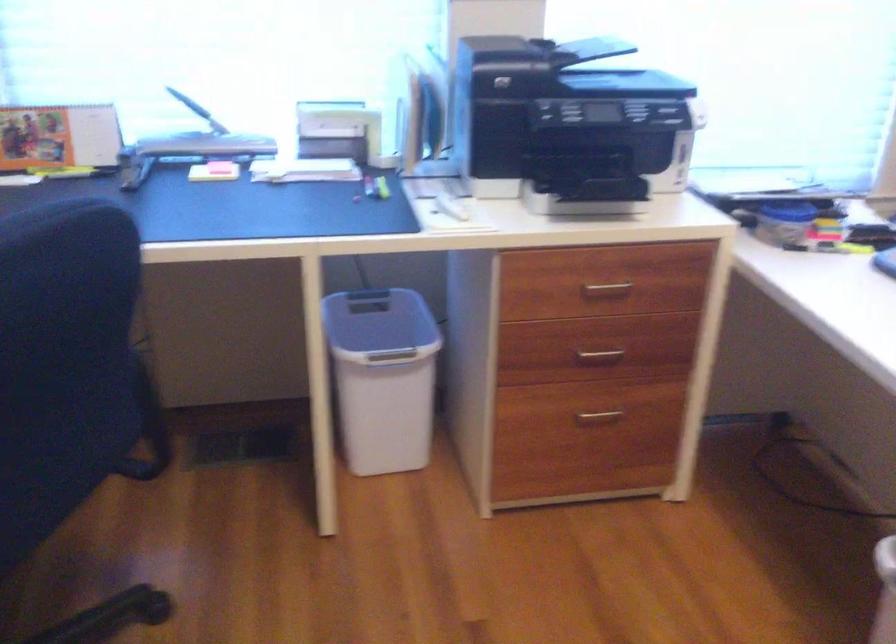
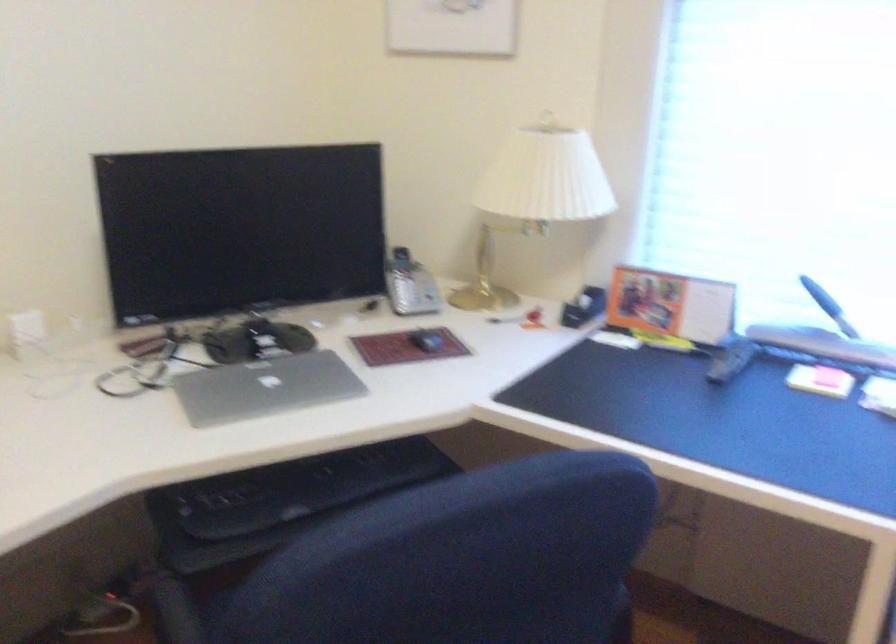
Where in the second image is the point corresponding to (226,167) from the first image?

(829, 377)